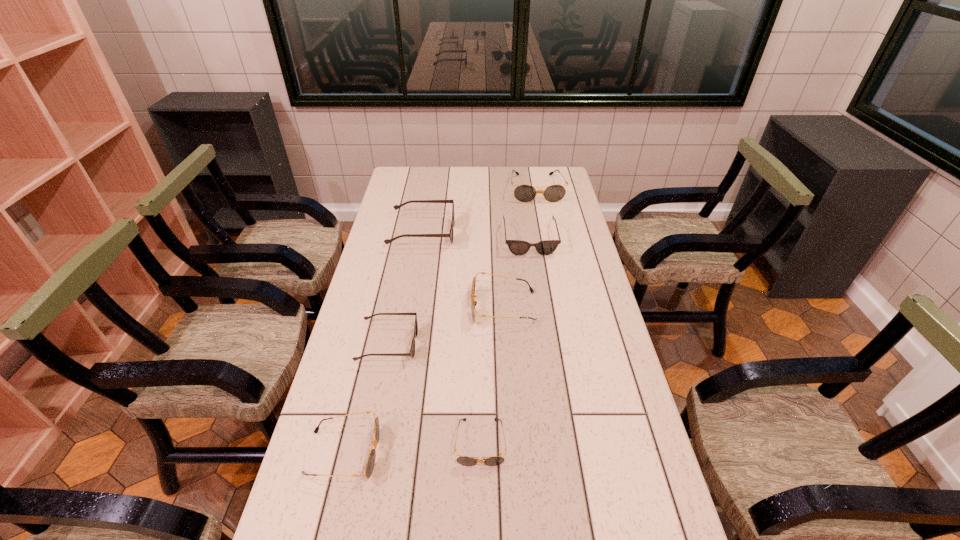
Where is `vacant area in the image that satisfies the following two spatial constraints: 1. on the front-facing side of the farthest object; 2. on the front-facing side of the second farthest black sunglasses`? The height and width of the screenshot is (540, 960). vacant area in the image that satisfies the following two spatial constraints: 1. on the front-facing side of the farthest object; 2. on the front-facing side of the second farthest black sunglasses is located at coordinates (559, 307).

You are a GUI agent. You are given a task and a screenshot of the screen. Output one action in this format:
    pyautogui.click(x=<x>, y=<y>)
    Task: Click on the free space that satisfies the following two spatial constraints: 1. on the front-facing side of the farthest black sunglasses; 2. on the front lenses of the biggest brown sunglasses
    The height and width of the screenshot is (540, 960).
    Given the screenshot: What is the action you would take?
    [544, 233]

I want to click on free point that satisfies the following two spatial constraints: 1. on the front lenses of the second biggest brown sunglasses; 2. on the front-facing side of the leftmost black sunglasses, so click(561, 453).

The image size is (960, 540). I want to click on blank area in the image that satisfies the following two spatial constraints: 1. on the front lenses of the second biggest brown sunglasses; 2. on the front-facing side of the third smallest black sunglasses, so click(x=540, y=307).